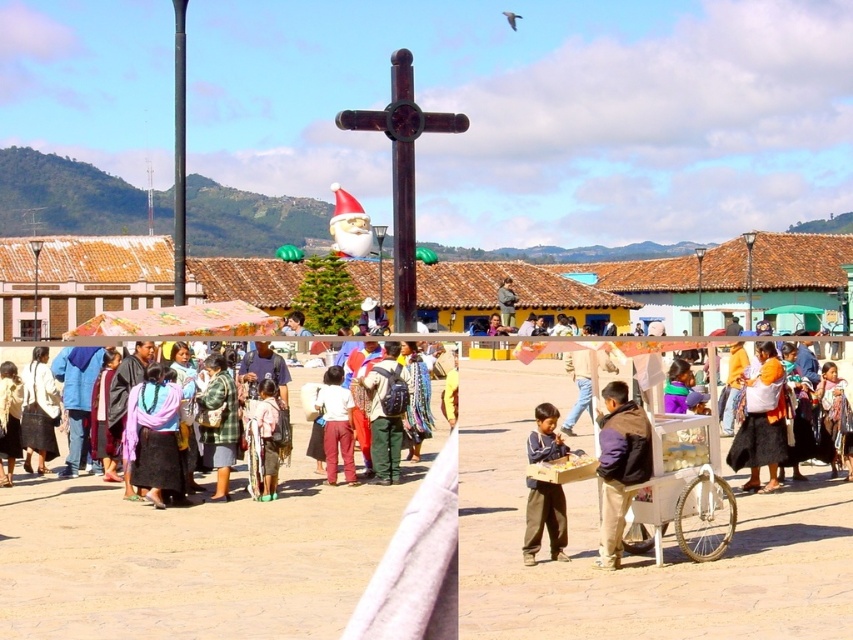
Question: Is white plastic cart at center to the left of matte pink pants at center from the viewer's perspective?

Choices:
 (A) yes
 (B) no

Answer: (B)

Question: Which object is positioned closest to the brown wooden cross at center?

Choices:
 (A) green fabric backpack at center
 (B) brown suede jacket at lower right
 (C) matte brown jacket at center

Answer: (A)

Question: Is dark brown pants at center in front of light pink fabric at center?

Choices:
 (A) no
 (B) yes

Answer: (B)

Question: Estimate the real-world distances between objects in this image. Which object is closer to the plaid fabric skirt at center?

Choices:
 (A) brown wooden cross at center
 (B) white plastic cart at center
 (C) matte brown jacket at center
 (D) brown suede jacket at lower right

Answer: (D)

Question: Which of these objects is positioned farthest from the dark brown pants at center?

Choices:
 (A) multicolored woven fabric at center
 (B) light pink fabric at center
 (C) brown suede jacket at lower right

Answer: (A)

Question: Does dark brown pants at center appear over light pink fabric at center?

Choices:
 (A) yes
 (B) no

Answer: (B)